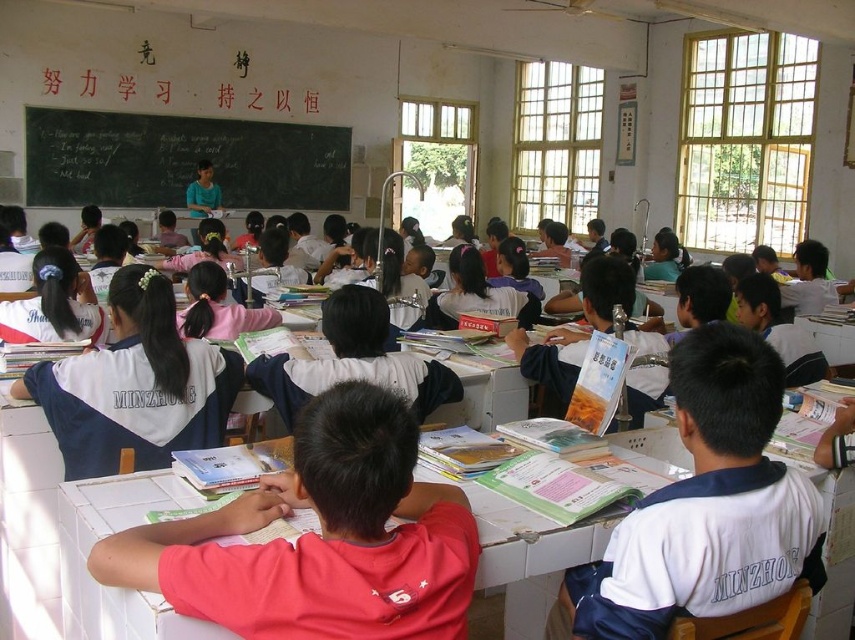
Is black chalkboard at upper left wider than white plastic table at center?

Yes.

Describe the element at coordinates (181, 161) in the screenshot. I see `black chalkboard at upper left` at that location.

Identify the location of black chalkboard at upper left. The height and width of the screenshot is (640, 855). (181, 161).

Describe the element at coordinates (708, 504) in the screenshot. I see `white matte uniform at center` at that location.

Who is shorter, white matte uniform at center or white plastic table at center?

white plastic table at center

Which is behind, point (773, 516) or point (116, 512)?

Point (116, 512)

This screenshot has width=855, height=640. In order to click on white matte uniform at center in this screenshot , I will do `click(708, 504)`.

Does pink fabric shirt at center appear under black chalkboard at upper left?

Correct, pink fabric shirt at center is located below black chalkboard at upper left.

Does pink fabric shirt at center have a greater height compared to black chalkboard at upper left?

In fact, pink fabric shirt at center may be shorter than black chalkboard at upper left.

Does point (223, 595) come closer to viewer compared to point (280, 188)?

Yes, it is in front of point (280, 188).

This screenshot has width=855, height=640. In order to click on pink fabric shirt at center in this screenshot , I will do `click(320, 538)`.